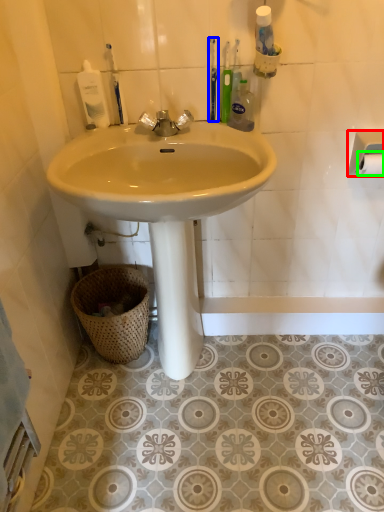
Question: Which object is the closest to the towel bar (highlighted by a red box)? Choose among these: toothbrush (highlighted by a blue box) or toilet paper (highlighted by a green box).

Choices:
 (A) toothbrush
 (B) toilet paper

Answer: (B)